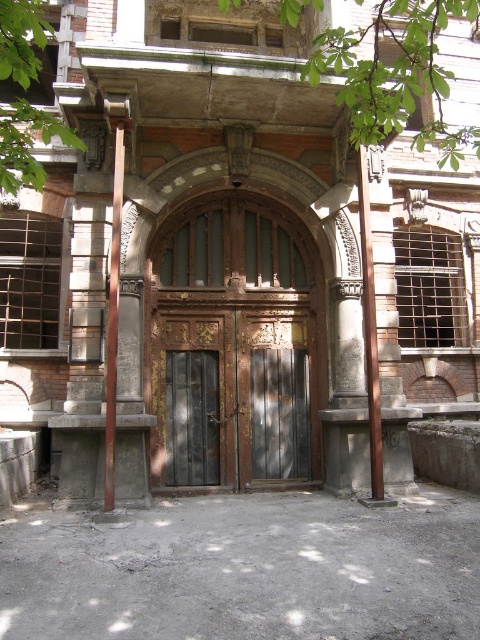
In the scene shown: You are standing at the entrance of an old building and want to enter through the wooden door at center. There is a brown wood post at right nearby. Which object is closer to the ground?

The wooden door at center is located below brown wood post at right, so the wooden door at center is closer to the ground.

You are a painter who needs to decide which object requires more paint. You see the wooden door at center and the brown wood post at right. Which object has a greater width?

The wooden door at center has a greater width than the brown wood post at right according to the description.

You are standing at the entrance of the old building and see two points marked on the wall. One is at point coordinates point [172,250] and the other at point [372,484]. From your perspective, which point is closer to you?

Point [372,484] is closer to you because it is in front of point [172,250].